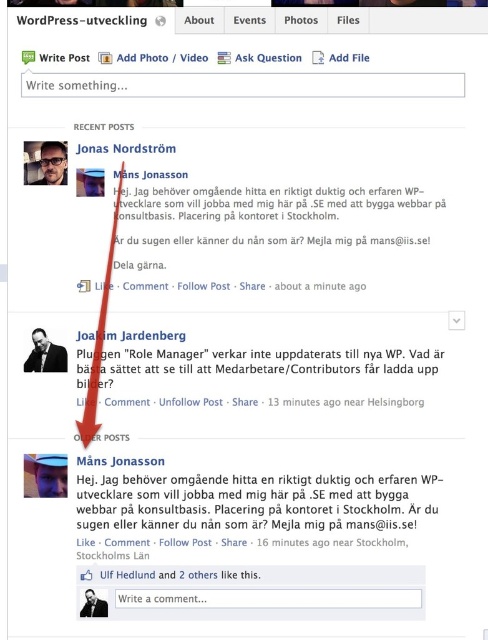
Which is below, matte black text at center or black matte text at upper left?

matte black text at center

Can you confirm if matte black text at center is thinner than black matte text at upper left?

No, matte black text at center is not thinner than black matte text at upper left.

Who is more distant from viewer, [153,492] or [73,17]?

Positioned behind is point [153,492].

This screenshot has height=640, width=488. Identify the location of matte black text at center. (259, 509).